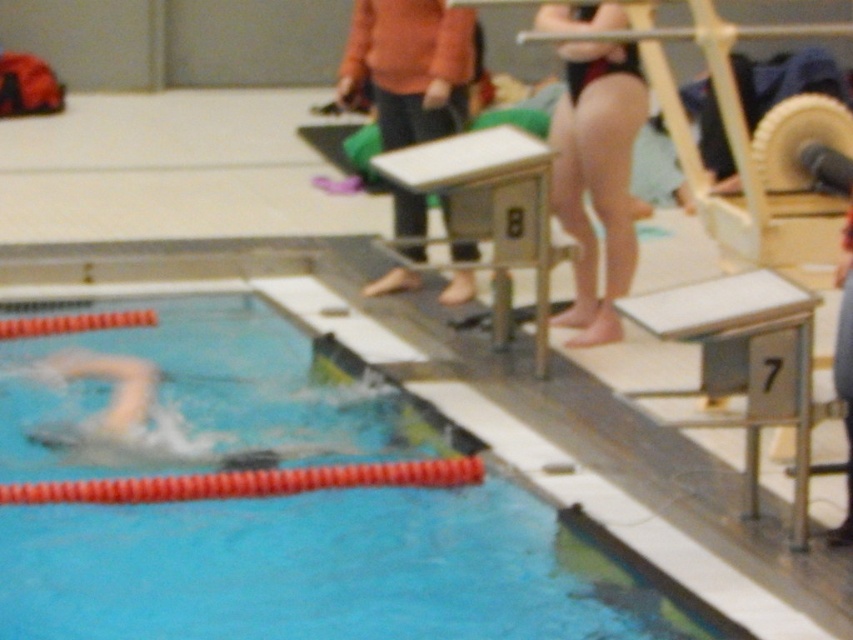
Who is taller, blue rubber pool lane at lower left or black swimsuit at upper right?

With more height is black swimsuit at upper right.

Between point (339, 515) and point (645, 84), which one is positioned in front?

Point (339, 515) is in front.

Describe the element at coordinates (328, 572) in the screenshot. Image resolution: width=853 pixels, height=640 pixels. I see `blue rubber pool lane at lower left` at that location.

The image size is (853, 640). Identify the location of blue rubber pool lane at lower left. tap(328, 572).